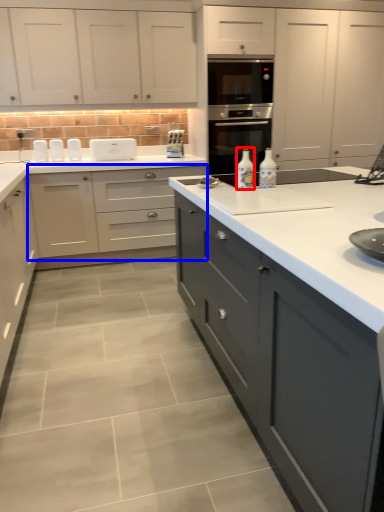
Question: Which point is further to the camera, bottle (highlighted by a red box) or cabinetry (highlighted by a blue box)?

Choices:
 (A) bottle
 (B) cabinetry

Answer: (B)